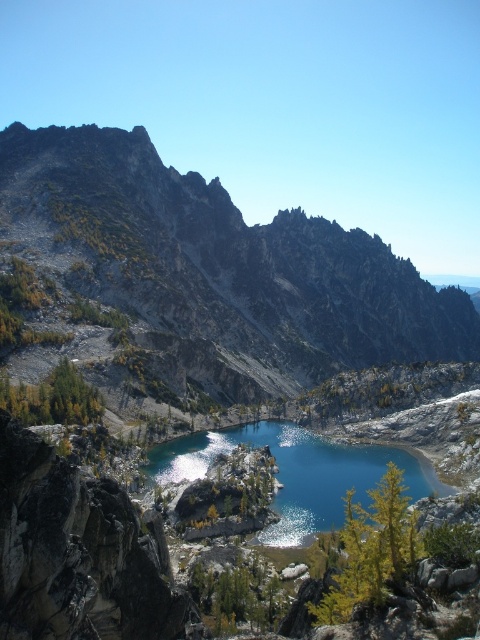
You are planning to set up a campsite in the mountainous area shown. You have a tent that requires a flat area wider than the rugged gray rock formation at center. Can the teal glossy water at center provide enough space for your tent?

The rugged gray rock formation at center is wider than the teal glossy water at center. Since your tent requires a flat area wider than the rugged gray rock formation at center, the teal glossy water at center is not wide enough to accommodate your tent.

You are standing at the edge of the rugged gray rock formation at center and want to reach the teal glossy water at center. Which direction should you move to get closer to the water?

You should move away from the rugged gray rock formation at center towards the teal glossy water at center since the rock formation is closer to you than the water.